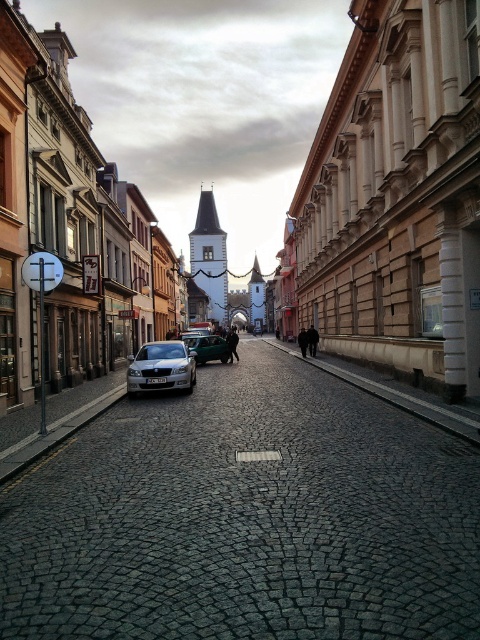
Between point (179, 381) and point (195, 342), which one is positioned in front?

Positioned in front is point (179, 381).

Is silver metallic sedan at center wider than metallic silver car at center?

No, silver metallic sedan at center is not wider than metallic silver car at center.

Image resolution: width=480 pixels, height=640 pixels. In order to click on silver metallic sedan at center in this screenshot , I will do `click(162, 368)`.

Can you confirm if shiny silver car at center is taller than matte stone street at center?

In fact, shiny silver car at center may be shorter than matte stone street at center.

Which is more to the right, shiny silver car at center or matte stone street at center?

From the viewer's perspective, shiny silver car at center appears more on the right side.

Which is behind, point (383, 456) or point (419, 205)?

Point (419, 205)

This screenshot has width=480, height=640. What are the coordinates of `shiny silver car at center` in the screenshot? It's located at (245, 518).

Which is above, matte stone street at center or silver metallic sedan at center?

Positioned higher is matte stone street at center.

Is point (421, 356) positioned after point (139, 358)?

No, (421, 356) is in front of (139, 358).

Identify the location of matte stone street at center. The image size is (480, 640). point(394,198).